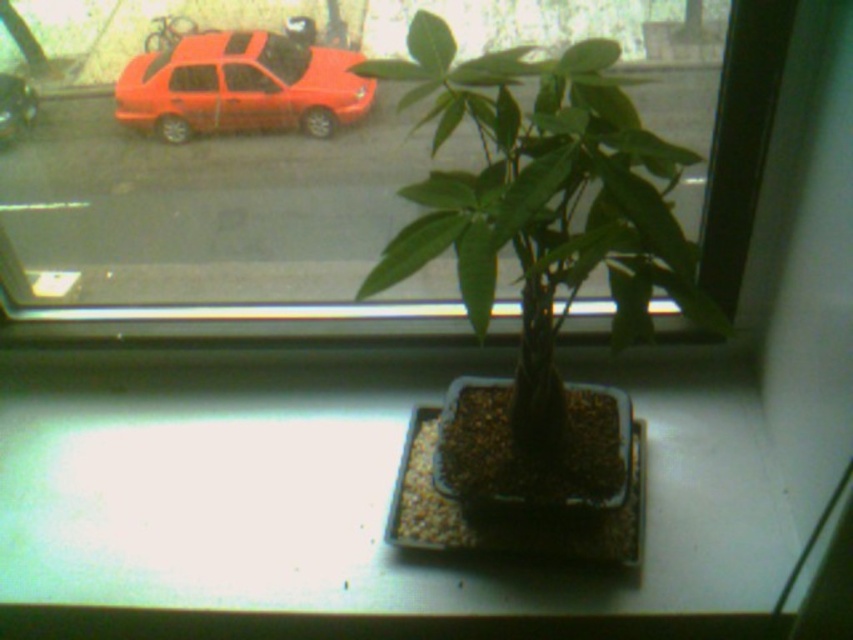
Can you confirm if green matte plant at center is positioned to the right of matte red car at upper left?

Indeed, green matte plant at center is positioned on the right side of matte red car at upper left.

Does green matte plant at center have a lesser width compared to matte red car at upper left?

In fact, green matte plant at center might be wider than matte red car at upper left.

Locate an element on the screen. This screenshot has width=853, height=640. green matte plant at center is located at coordinates (540, 253).

Image resolution: width=853 pixels, height=640 pixels. Find the location of `green matte plant at center`. green matte plant at center is located at coordinates (540, 253).

Which is more to the right, white matte window sill at center or matte red car at upper left?

Positioned to the right is white matte window sill at center.

Between white matte window sill at center and matte red car at upper left, which one is positioned lower?

white matte window sill at center is below.

Between point (254, 390) and point (222, 115), which one is positioned behind?

The point (254, 390) is more distant.

Find the location of a particular element. Image resolution: width=853 pixels, height=640 pixels. white matte window sill at center is located at coordinates (378, 496).

Which is in front, point (119, 83) or point (4, 141)?

Point (119, 83)

Does matte red car at upper left have a greater width compared to metallic red car at upper left?

Yes.

I want to click on matte red car at upper left, so click(241, 86).

You are a GUI agent. You are given a task and a screenshot of the screen. Output one action in this format:
    pyautogui.click(x=<x>, y=<y>)
    Task: Click on the matte red car at upper left
    
    Given the screenshot: What is the action you would take?
    pyautogui.click(x=241, y=86)